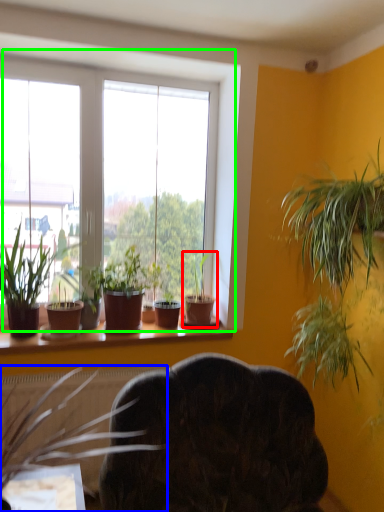
Question: Which object is positioned closest to houseplant (highlighted by a red box)? Select from houseplant (highlighted by a blue box) and window (highlighted by a green box).

Choices:
 (A) houseplant
 (B) window

Answer: (A)